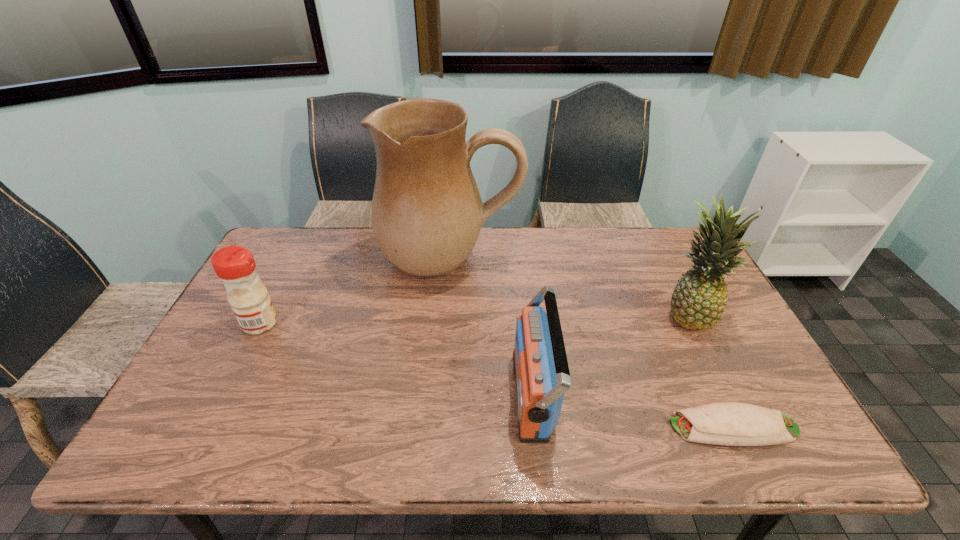
Where is `free location located on the front-facing side of the radio receiver`? Image resolution: width=960 pixels, height=540 pixels. free location located on the front-facing side of the radio receiver is located at coordinates (484, 394).

You are a GUI agent. You are given a task and a screenshot of the screen. Output one action in this format:
    pyautogui.click(x=<x>, y=<y>)
    Task: Click on the vacant space located 0.060m on the front-facing side of the radio receiver
    The height and width of the screenshot is (540, 960).
    Given the screenshot: What is the action you would take?
    pyautogui.click(x=488, y=394)

Locate an element on the screen. free space located at the bitten end of the shortest object is located at coordinates (561, 427).

I want to click on blank area located 0.390m at the bitten end of the shortest object, so click(x=499, y=427).

The width and height of the screenshot is (960, 540). I want to click on free location located 0.170m at the bitten end of the shortest object, so click(x=595, y=427).

The width and height of the screenshot is (960, 540). What are the coordinates of `object at the far edge` in the screenshot? It's located at (426, 214).

This screenshot has height=540, width=960. I want to click on radio receiver that is at the near edge, so click(x=541, y=370).

I want to click on burrito that is at the near edge, so click(728, 423).

Find the location of `object that is at the left edge`. object that is at the left edge is located at coordinates (234, 265).

At what (x,y) coordinates should I click in order to perform the action: click on pineapple that is at the right edge. Please return your answer as a coordinate pair (x, y). Looking at the image, I should click on (698, 301).